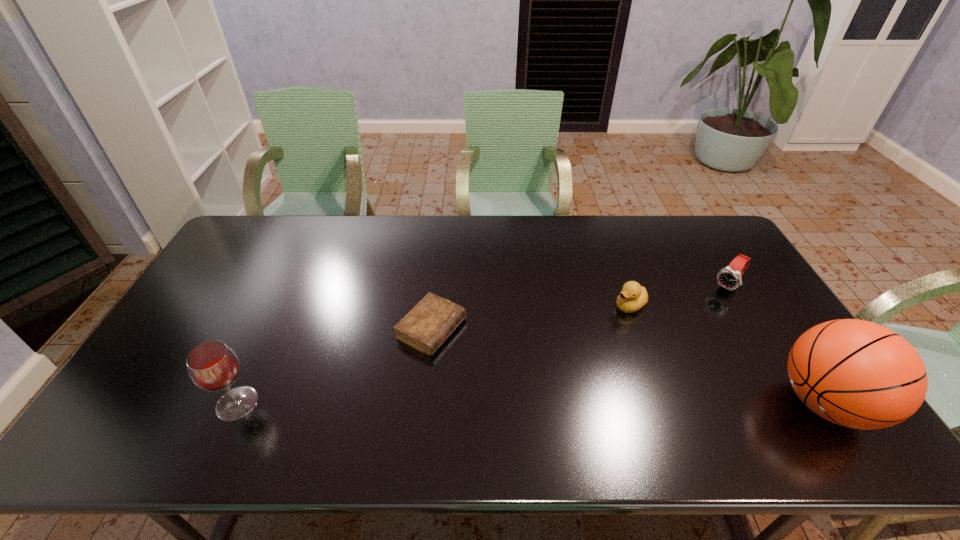
Find the location of a particular element. vacant space situated 0.080m on the face of the watch is located at coordinates (708, 308).

Where is `blank area located on the face of the watch`? Image resolution: width=960 pixels, height=540 pixels. blank area located on the face of the watch is located at coordinates (694, 323).

This screenshot has width=960, height=540. What are the coordinates of `vacant space located 0.230m facing forward on the duckling` in the screenshot? It's located at (560, 345).

Locate an element on the screen. This screenshot has width=960, height=540. blank space located 0.350m facing forward on the duckling is located at coordinates (525, 365).

At what (x,y) coordinates should I click in order to perform the action: click on free location located 0.300m facing forward on the duckling. Please return your answer as a coordinate pair (x, y). The width and height of the screenshot is (960, 540). Looking at the image, I should click on (540, 356).

Where is `vacant space located 0.190m on the spine side of the shortest object`? vacant space located 0.190m on the spine side of the shortest object is located at coordinates (521, 374).

Find the location of a particular element. free space located 0.230m on the spine side of the shortest object is located at coordinates (535, 381).

Image resolution: width=960 pixels, height=540 pixels. Identify the location of vacant space located 0.230m on the spine side of the shortest object. (535, 381).

You are a GUI agent. You are given a task and a screenshot of the screen. Output one action in this format:
    pyautogui.click(x=<x>, y=<y>)
    Task: Click on the wineglass that is at the near edge
    The image size is (960, 540).
    Given the screenshot: What is the action you would take?
    pyautogui.click(x=213, y=366)

At what (x,y) coordinates should I click in order to perform the action: click on basketball that is at the near edge. Please return your answer as a coordinate pair (x, y). The width and height of the screenshot is (960, 540). Looking at the image, I should click on (858, 374).